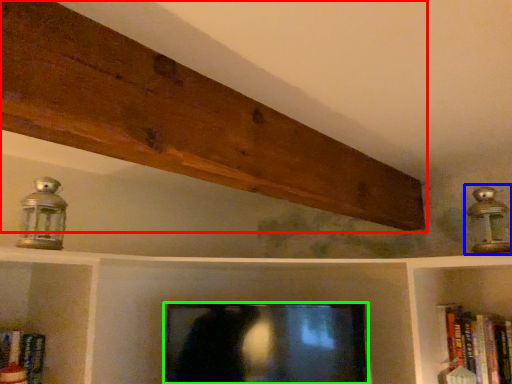
Question: Considering the real-world distances, which object is farthest from plank (highlighted by a red box)? lamp (highlighted by a blue box) or television (highlighted by a green box)?

Choices:
 (A) lamp
 (B) television

Answer: (B)